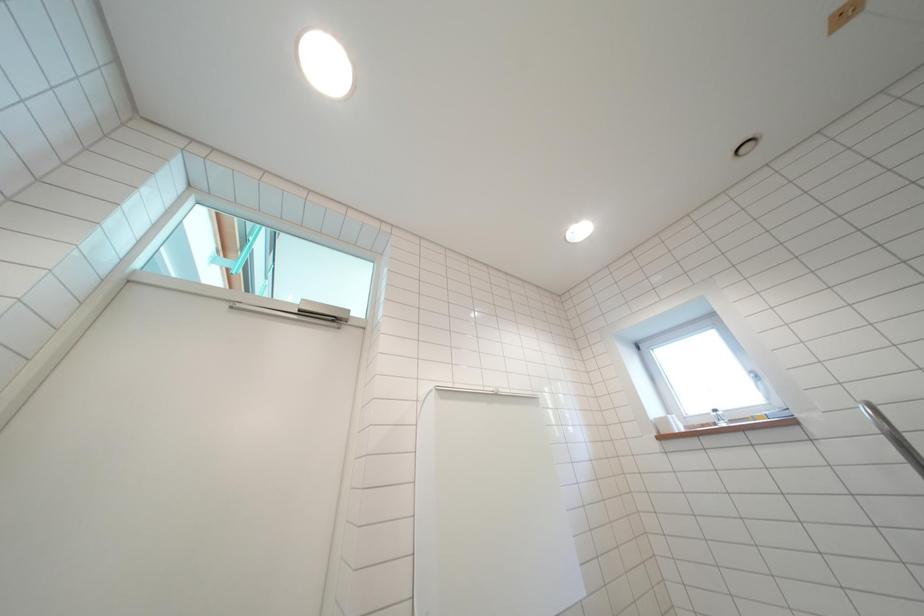
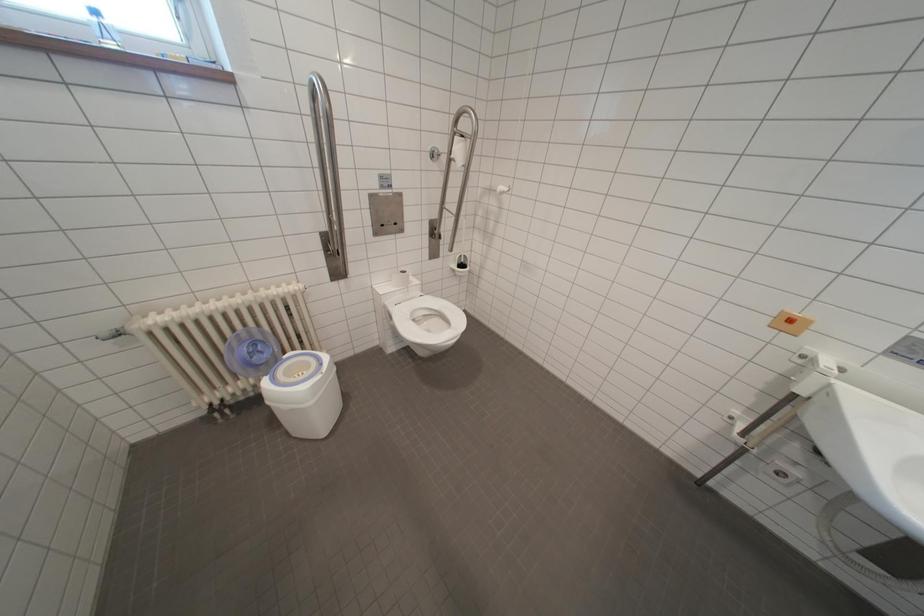
The first image is from the beginning of the video and the second image is from the end. How did the camera likely rotate when shooting the video?

The camera's rotation is toward right-down.